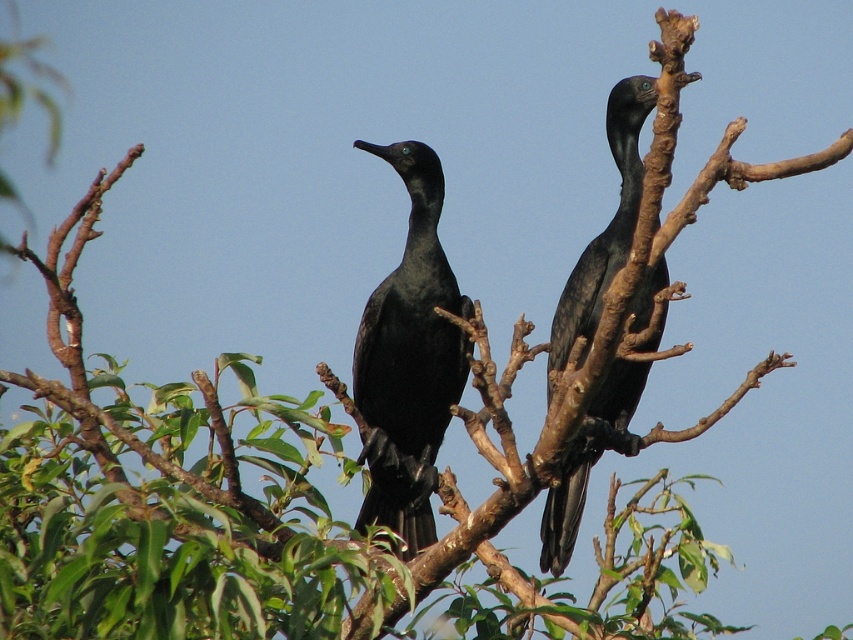
Does shiny black bird at center appear over shiny black bird at upper right?

No.

Can you confirm if shiny black bird at center is positioned to the left of shiny black bird at upper right?

Indeed, shiny black bird at center is positioned on the left side of shiny black bird at upper right.

Where is `shiny black bird at center`? This screenshot has width=853, height=640. shiny black bird at center is located at coordinates (409, 360).